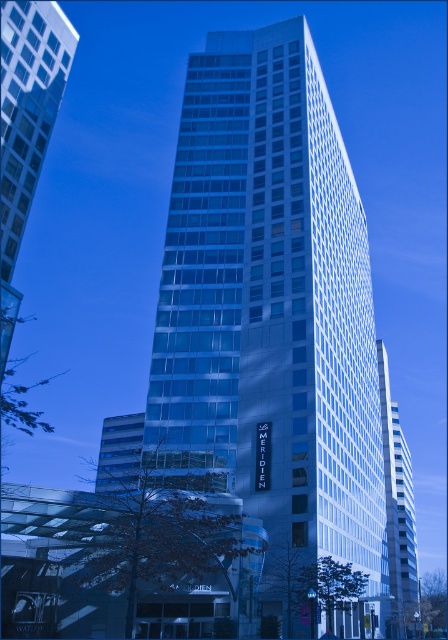
You are standing in front of the modern high rise and want to take a photo of both the transparent glass building at left and the white glass building at center. Which building should you position yourself closer to in order to capture both in the frame?

You should position yourself closer to the transparent glass building at left since it is to the left of the white glass building at center, allowing both to be included in the frame when centered.

You are standing on the sidewalk in front of the glassy white skyscraper at center and the white glass building at center. Which one is closer to you?

The glassy white skyscraper at center is closer to you since it is in front of the white glass building at center.

You are standing in front of the modern high rise building. You see the transparent glass building at left and the white glass building at center. Which one is higher up in the scene?

The transparent glass building at left is located above the white glass building at center, so it is higher up in the scene.